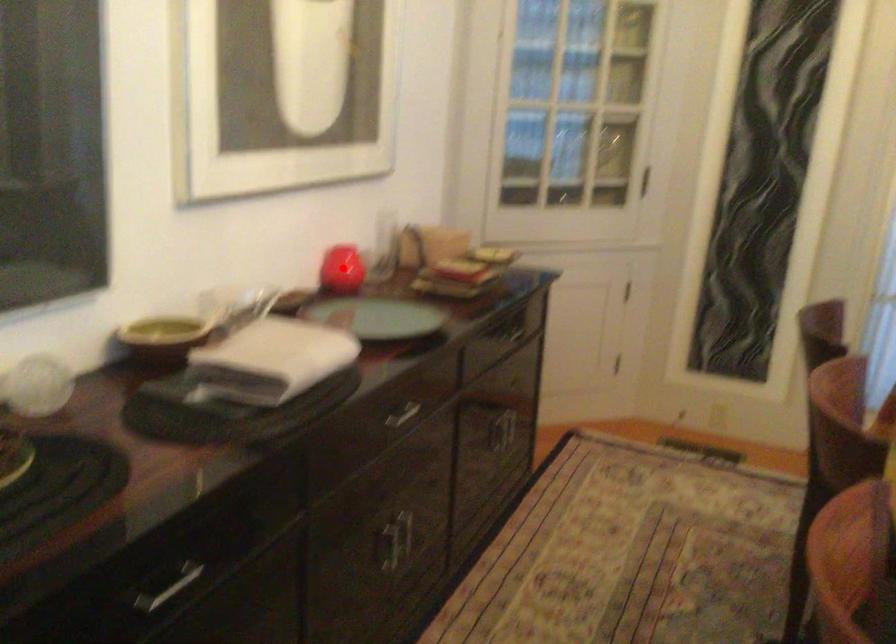
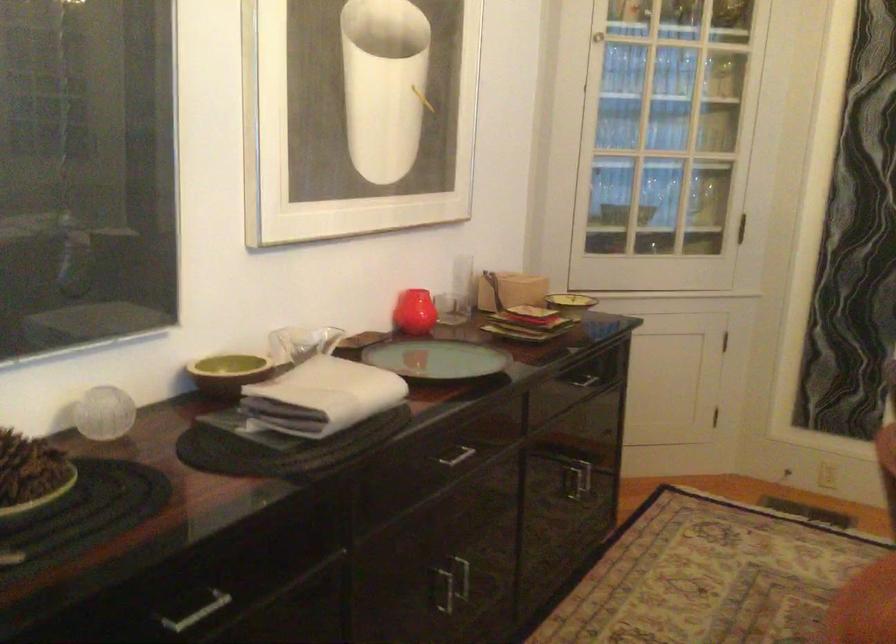
Find the pixel in the second image that matches the highlighted location in the first image.

(414, 312)